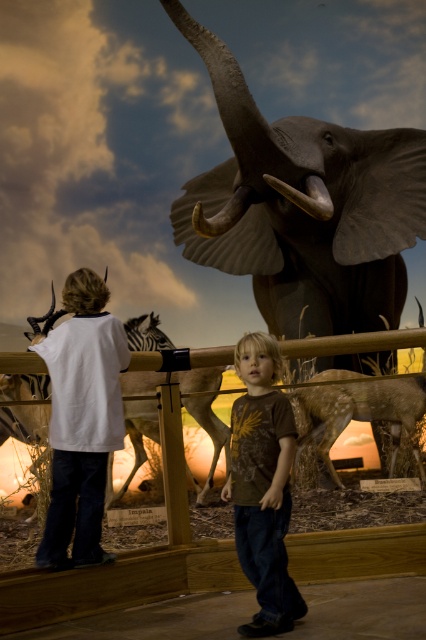
In the scene shown: You are a photographer standing 1.7 meters tall and holding a camera at your eye level. You want to take a photo of the gray matte elephant at upper center. Considering your height and the distance between you and the elephant, will you be able to capture the entire elephant in your photo without needing to move closer?

The gray matte elephant at upper center and camera are 3.27 meters apart. Since you are 1.7 meters tall and holding the camera at eye level, the distance is sufficient to capture the entire elephant in the photo without needing to move closer.

You are a museum guide explaining the exhibit to visitors. You need to point out the gray matte elephant at upper center and the matte ivory tusk at upper center. Which object is located above the other?

The gray matte elephant at upper center is positioned over the matte ivory tusk at upper center, meaning the elephant is above the tusk.